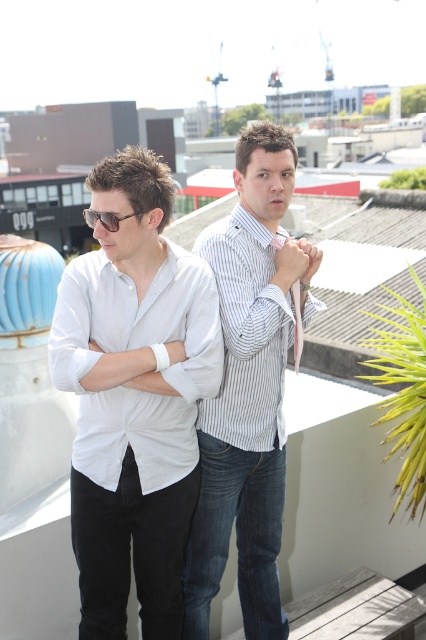
Question: Considering the real-world distances, which object is farthest from the white cotton shirt at center?

Choices:
 (A) white striped shirt at center
 (B) striped fabric shirt at center

Answer: (A)

Question: Is the position of white cotton dress shirt at left more distant than that of striped fabric shirt at center?

Choices:
 (A) yes
 (B) no

Answer: (B)

Question: Considering the real-world distances, which object is farthest from the white cotton dress shirt at left?

Choices:
 (A) white striped shirt at center
 (B) white cotton shirt at center

Answer: (A)

Question: Is white striped shirt at center thinner than striped fabric shirt at center?

Choices:
 (A) yes
 (B) no

Answer: (B)

Question: Does white cotton dress shirt at left appear under white striped shirt at center?

Choices:
 (A) no
 (B) yes

Answer: (B)

Question: Among these objects, which one is nearest to the camera?

Choices:
 (A) white cotton shirt at center
 (B) white cotton dress shirt at left
 (C) silky white tie at center

Answer: (A)